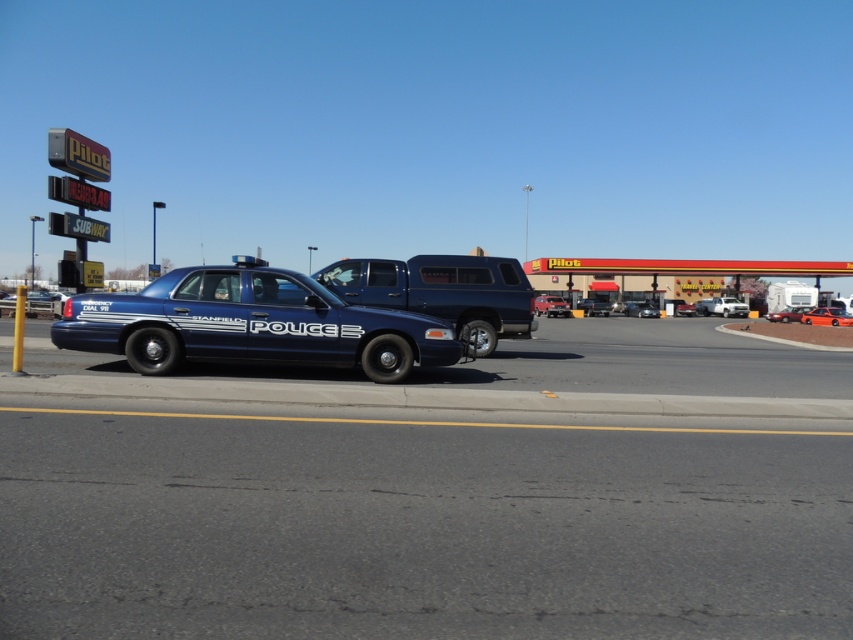
Question: Is glossy blue police car at center wider than orange matte sedan at center?

Choices:
 (A) no
 (B) yes

Answer: (B)

Question: Which object is the closest to the metallic silver sedan at center?

Choices:
 (A) glossy blue police car at center
 (B) glossy blue pickup truck at center

Answer: (B)

Question: Is glossy blue police car at center positioned in front of glossy blue pickup truck at center?

Choices:
 (A) no
 (B) yes

Answer: (B)

Question: Which point appears closest to the camera in this image?

Choices:
 (A) (561, 259)
 (B) (340, 310)
 (C) (804, 308)

Answer: (B)

Question: Considering the real-world distances, which object is farthest from the glossy blue police car at center?

Choices:
 (A) glossy blue pickup truck at center
 (B) metallic silver sedan at center

Answer: (B)

Question: Is glossy blue police car at center to the left of metallic silver sedan at center from the viewer's perspective?

Choices:
 (A) no
 (B) yes

Answer: (B)